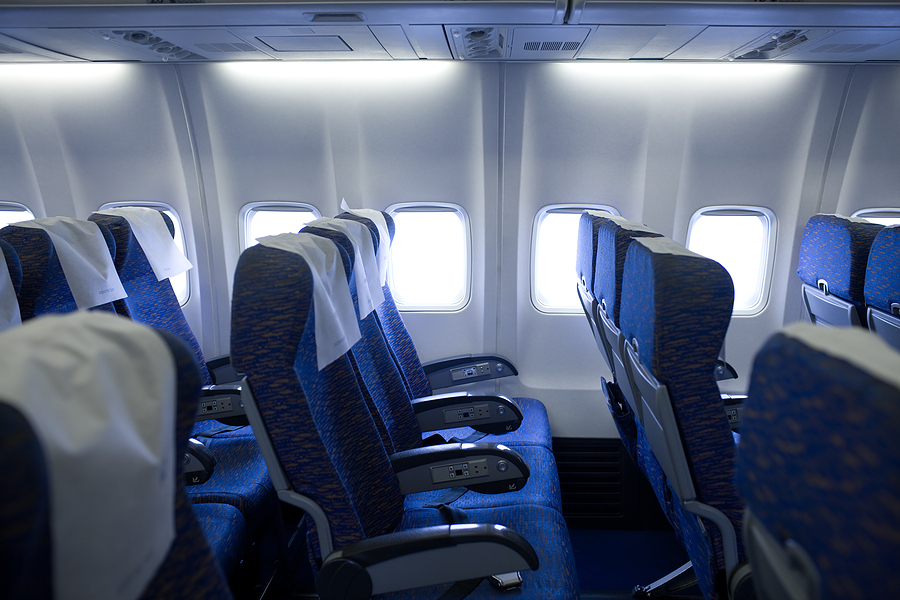
You are a GUI agent. You are given a task and a screenshot of the screen. Output one action in this format:
    pyautogui.click(x=<x>, y=<y>)
    Task: Click on the seat handles
    
    Given the screenshot: What is the action you would take?
    pyautogui.click(x=452, y=555), pyautogui.click(x=462, y=465), pyautogui.click(x=468, y=404), pyautogui.click(x=470, y=363), pyautogui.click(x=220, y=385), pyautogui.click(x=225, y=368), pyautogui.click(x=192, y=461), pyautogui.click(x=735, y=402), pyautogui.click(x=730, y=372)